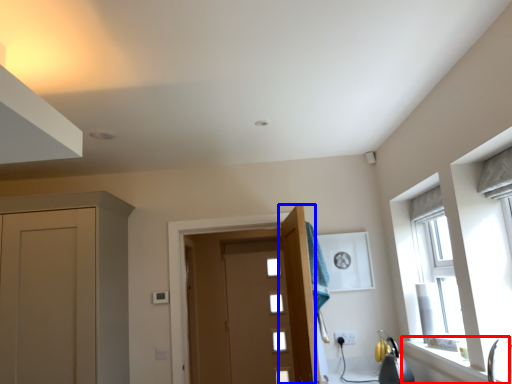
Question: Which object is closer to the camera taking this photo, window sill (highlighted by a red box) or door (highlighted by a blue box)?

Choices:
 (A) window sill
 (B) door

Answer: (A)